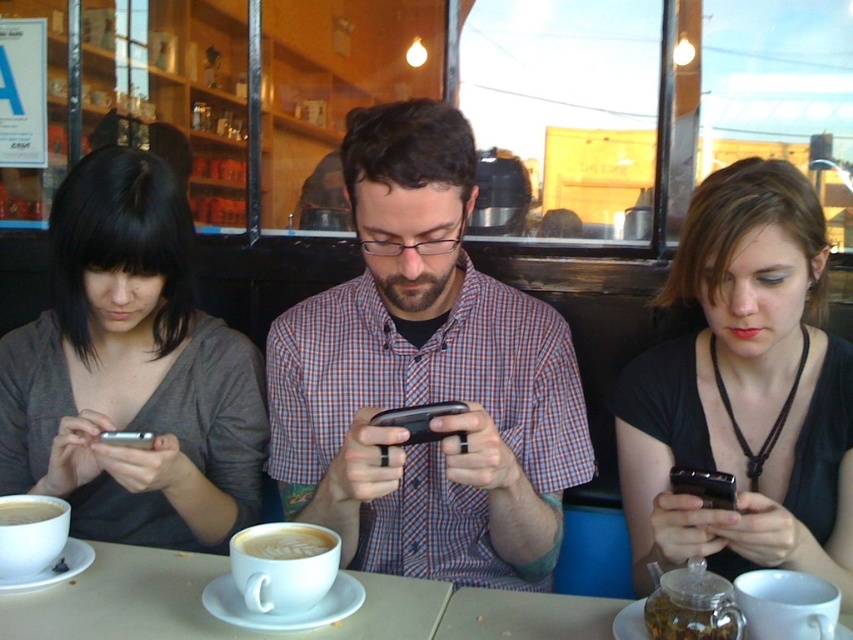
Question: Which point is closer to the camera?

Choices:
 (A) (138, 227)
 (B) (434, 492)

Answer: (A)

Question: Is plaid shirt at center to the right of smooth matte cup at lower left from the viewer's perspective?

Choices:
 (A) yes
 (B) no

Answer: (A)

Question: Does white frothy coffee at center have a larger size compared to black matte smartphone at lower right?

Choices:
 (A) yes
 (B) no

Answer: (A)

Question: Estimate the real-world distances between objects in this image. Which object is farther from the black matte smartphone at lower right?

Choices:
 (A) plaid shirt at center
 (B) white matte table at center
 (C) black matte phone at center

Answer: (B)

Question: Which of the following is the closest to the observer?

Choices:
 (A) plaid shirt at center
 (B) black matte smartphone at lower right
 (C) white frothy coffee at center
 (D) smooth matte cup at lower left

Answer: (B)

Question: Is matte gray shirt at left positioned in front of white frothy coffee at center?

Choices:
 (A) no
 (B) yes

Answer: (A)